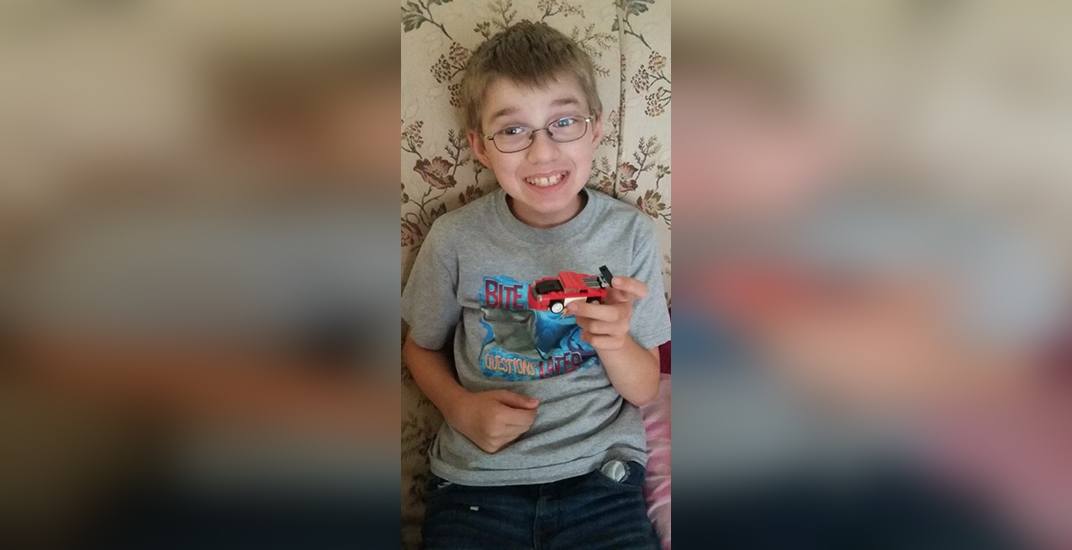
You are a GUI agent. You are given a task and a screenshot of the screen. Output one action in this format:
    pyautogui.click(x=<x>, y=<y>)
    Task: Click on the toy
    This screenshot has height=550, width=1072.
    Given the screenshot: What is the action you would take?
    pyautogui.click(x=561, y=284)